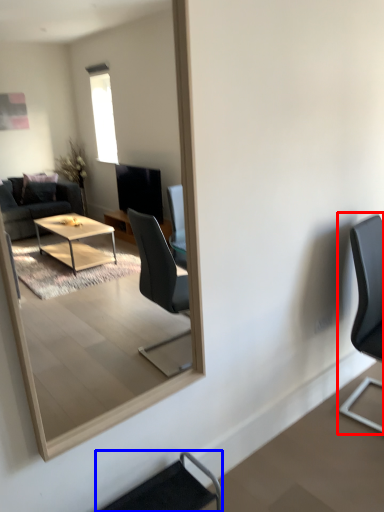
Question: Which of the following is the farthest to the observer, chair (highlighted by a red box) or chair (highlighted by a blue box)?

Choices:
 (A) chair
 (B) chair

Answer: (A)